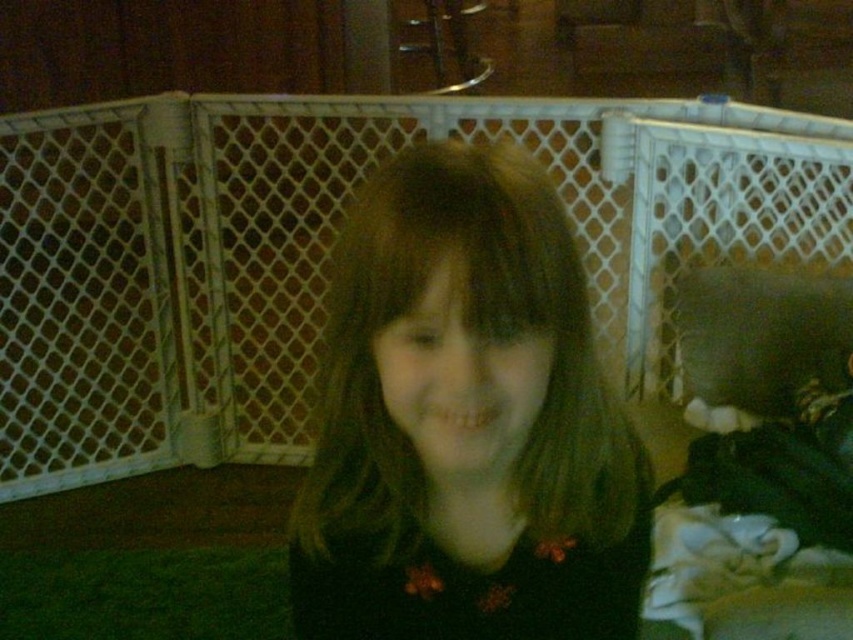
You are a photographer setting up for a portrait of the young girl in the scene. You notice two points marked in the image. You want to ensure that the point closer to the camera is within the focus range of your lens. Which of the two points, point [490,588] or point [846,337], is closer to the camera?

Point [490,588] is closer to the camera than point [846,337], so you should ensure it is within the focus range.

The girl is standing in a room with a white plastic gate in the background. There is a point marked at coordinates (466, 420). What is located at that point?

At point (466, 420) lies dark brown hair at center.

Based on the scene description, which object is taller between the dark brown hair at center and the dark gray fabric pillow at right?

The dark brown hair at center is taller than the dark gray fabric pillow at right.